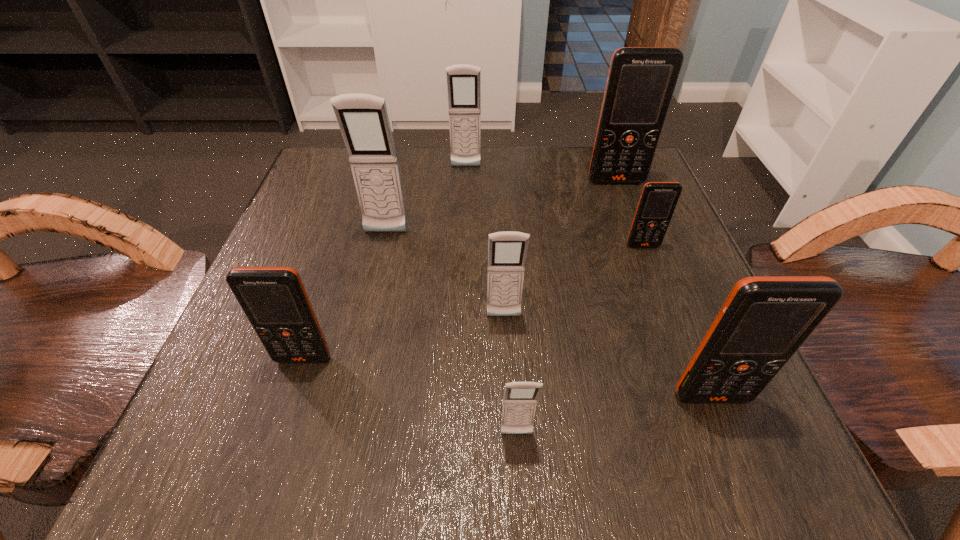
Locate an element on the screen. vacant space located on the front-facing side of the second nearest gray cellular telephone is located at coordinates (510, 445).

Find the location of `vacant region located 0.100m on the screen of the sixth farthest cellular telephone`. vacant region located 0.100m on the screen of the sixth farthest cellular telephone is located at coordinates (279, 434).

This screenshot has width=960, height=540. What are the coordinates of `vacant space located 0.350m on the screen of the fifth nearest object` in the screenshot? It's located at (716, 438).

Find the location of `object located at the near edge`. object located at the near edge is located at coordinates (520, 398).

Locate an element on the screen. object located in the far right corner section of the desktop is located at coordinates (x=641, y=81).

In order to click on free space at the far edge of the desktop in this screenshot , I will do [463, 193].

This screenshot has height=540, width=960. What are the coordinates of `blank space at the near edge of the desktop` in the screenshot? It's located at point(608,420).

The image size is (960, 540). What are the coordinates of `vacant space at the left edge of the desktop` in the screenshot? It's located at (255, 333).

Where is `free spot at the right edge of the desktop`? free spot at the right edge of the desktop is located at coordinates [x=615, y=212].

Find the location of `blank space at the far left corner of the desktop`. blank space at the far left corner of the desktop is located at coordinates (341, 209).